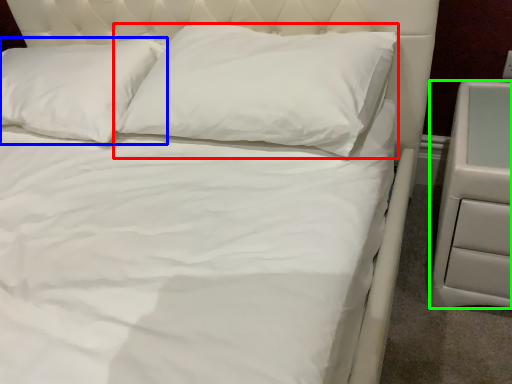
Question: Which object is positioned closest to pillow (highlighted by a red box)? Select from pillow (highlighted by a blue box) and nightstand (highlighted by a green box).

Choices:
 (A) pillow
 (B) nightstand

Answer: (A)